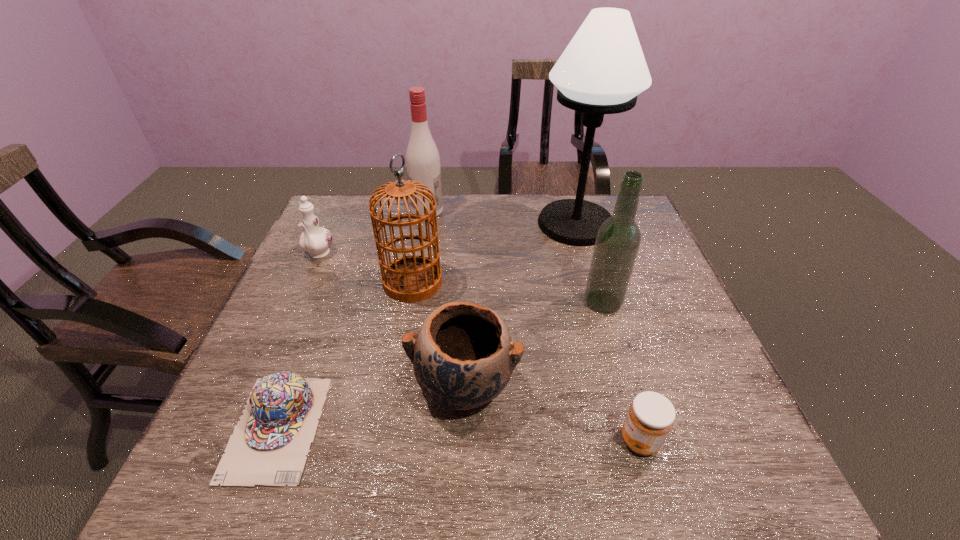
You are a GUI agent. You are given a task and a screenshot of the screen. Output one action in this format:
    pyautogui.click(x=<x>, y=<y>)
    Task: Click on the vacant area between the pottery and the jam
    
    Given the screenshot: What is the action you would take?
    pyautogui.click(x=552, y=414)

Where is `free space between the liquor and the birdcage`? free space between the liquor and the birdcage is located at coordinates (508, 292).

The image size is (960, 540). In order to click on object that ranks as the seventh closest to the tallest object in this screenshot , I will do `click(268, 447)`.

Find the location of a particular element. object that is the fourth closest one to the birdcage is located at coordinates (268, 447).

Where is `free space that satisfies the following two spatial constraints: 1. on the back side of the liquor; 2. on the label of the alcohol`? The image size is (960, 540). free space that satisfies the following two spatial constraints: 1. on the back side of the liquor; 2. on the label of the alcohol is located at coordinates (575, 211).

Locate an element on the screen. This screenshot has width=960, height=540. free space that satisfies the following two spatial constraints: 1. at the spout of the chinaware; 2. on the right side of the birdcage is located at coordinates (306, 282).

The height and width of the screenshot is (540, 960). In order to click on vacant region that satisfies the following two spatial constraints: 1. at the spout of the pottery; 2. on the right side of the chinaware in this screenshot , I will do `click(259, 387)`.

The width and height of the screenshot is (960, 540). Find the location of `free spot that satisfies the following two spatial constraints: 1. on the back side of the tallest object; 2. on the right side of the birdcage`. free spot that satisfies the following two spatial constraints: 1. on the back side of the tallest object; 2. on the right side of the birdcage is located at coordinates (422, 224).

The image size is (960, 540). Identify the location of vacant space that satisfies the following two spatial constraints: 1. on the back side of the pottery; 2. on the label of the alcohol. (469, 211).

You are a GUI agent. You are given a task and a screenshot of the screen. Output one action in this format:
    pyautogui.click(x=<x>, y=<y>)
    Task: Click on the free region that satisfies the following two spatial constraints: 1. on the label of the alcohol; 2. on the front side of the birdcage
    This screenshot has height=540, width=960.
    Given the screenshot: What is the action you would take?
    pyautogui.click(x=416, y=282)